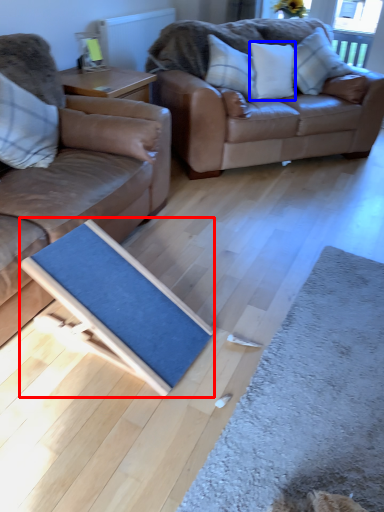
Question: Which object is closer to the camera taking this photo, doormat (highlighted by a red box) or pillow (highlighted by a blue box)?

Choices:
 (A) doormat
 (B) pillow

Answer: (A)